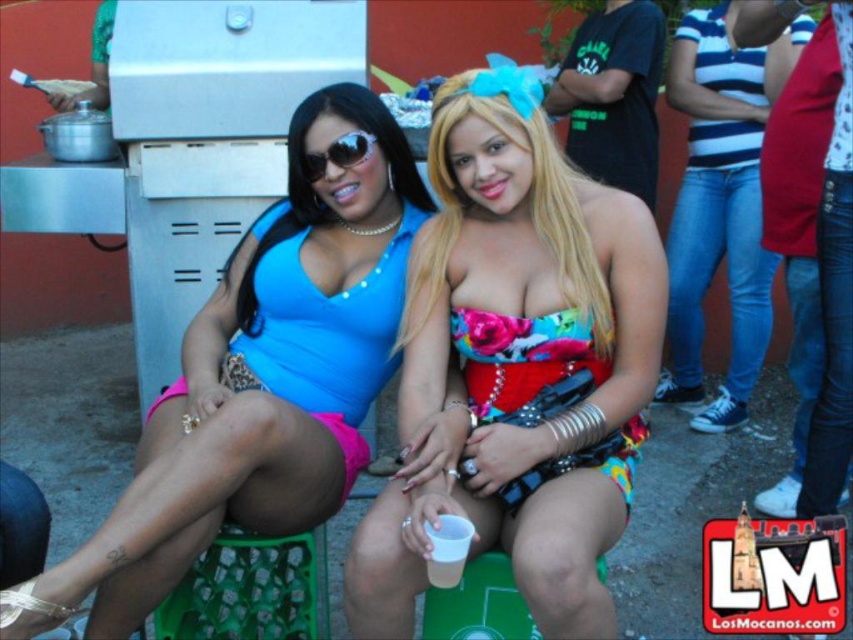
This screenshot has width=853, height=640. What do you see at coordinates (259, 380) in the screenshot? I see `matte blue dress at center` at bounding box center [259, 380].

Who is positioned more to the left, matte blue dress at center or sunglasses at center?

matte blue dress at center

Between point (347, 106) and point (349, 138), which one is positioned behind?

The point (347, 106) is more distant.

You are a GUI agent. You are given a task and a screenshot of the screen. Output one action in this format:
    pyautogui.click(x=<x>, y=<y>)
    Task: Click on the matte blue dress at center
    
    Given the screenshot: What is the action you would take?
    pyautogui.click(x=259, y=380)

Who is more distant from viewer, (419, 481) or (323, 250)?

The point (323, 250) is more distant.

Measure the distance between floral strapless dress at center and camera.

The distance of floral strapless dress at center from camera is 4.57 feet.

The height and width of the screenshot is (640, 853). Find the location of `floral strapless dress at center`. floral strapless dress at center is located at coordinates pyautogui.click(x=514, y=364).

Is matte blue dress at center to the right of floral fabric dress at center from the viewer's perspective?

No, matte blue dress at center is not to the right of floral fabric dress at center.

Does matte blue dress at center have a smaller size compared to floral fabric dress at center?

Incorrect, matte blue dress at center is not smaller in size than floral fabric dress at center.

Identify the location of matte blue dress at center. (259, 380).

What are the coordinates of `matte blue dress at center` in the screenshot? It's located at (259, 380).